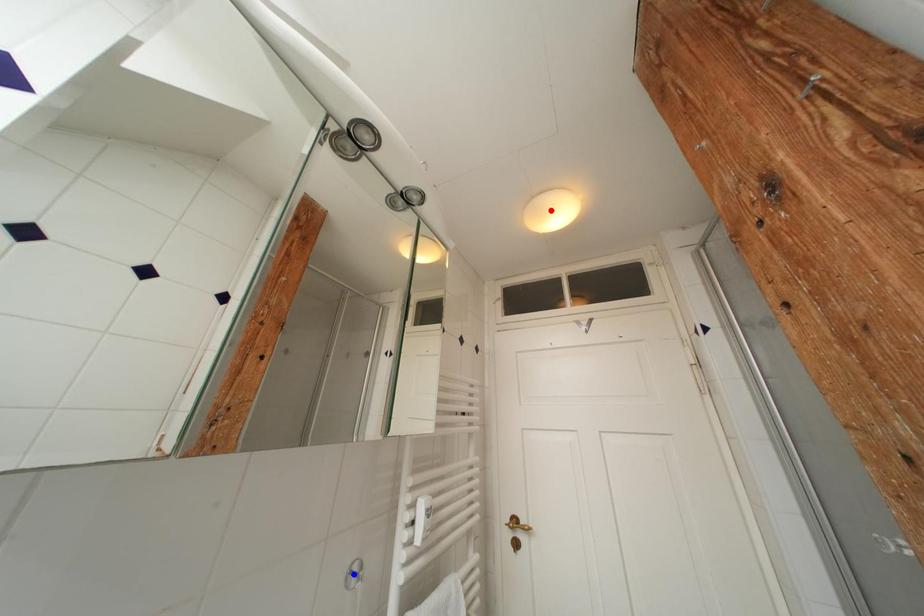
Question: Two points are marked on the image. Which point is closer to the camera?

Choices:
 (A) Blue point is closer.
 (B) Red point is closer.

Answer: (A)